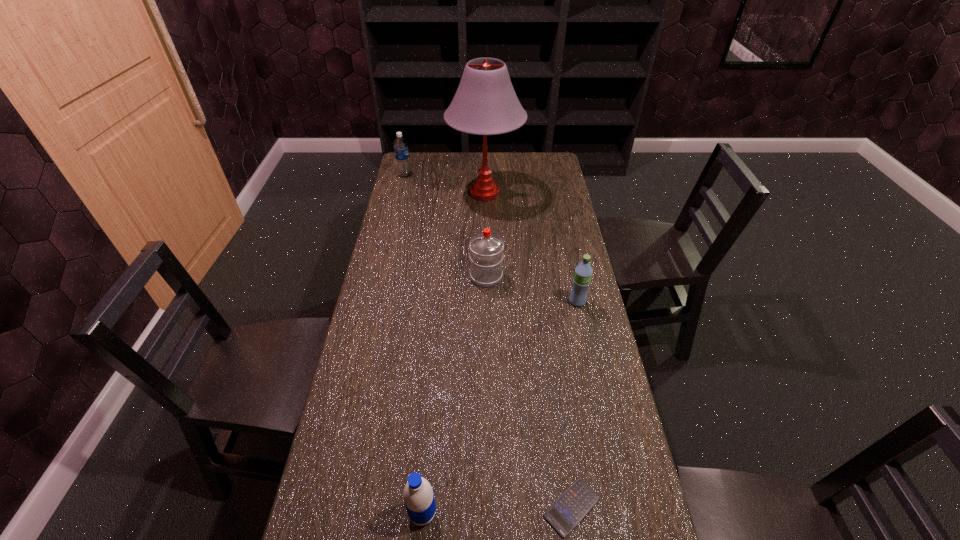
Find the location of a particular element. The width and height of the screenshot is (960, 540). empty location between the rightmost water bottle and the fourth nearest object is located at coordinates (532, 289).

The height and width of the screenshot is (540, 960). Find the location of `blank region between the rightmost water bottle and the nearest water bottle`. blank region between the rightmost water bottle and the nearest water bottle is located at coordinates (500, 408).

The height and width of the screenshot is (540, 960). Identify the location of free area in between the calculator and the third water bottle from left to right. (529, 392).

The height and width of the screenshot is (540, 960). I want to click on vacant region between the table lamp and the third water bottle from right to left, so click(x=454, y=353).

Identify the location of free space between the table lamp and the leftmost object. (444, 184).

Locate an element on the screen. The width and height of the screenshot is (960, 540). vacant point located between the farthest water bottle and the third water bottle from right to left is located at coordinates (414, 344).

The image size is (960, 540). I want to click on empty location between the rightmost object and the tallest object, so click(531, 247).

Identify the location of free area in between the table lamp and the fourth farthest object. Image resolution: width=960 pixels, height=540 pixels. (531, 247).

Find the location of a particular element. vacant point located between the nearest water bottle and the third farthest water bottle is located at coordinates (500, 408).

This screenshot has height=540, width=960. In order to click on object that ranks as the second closest to the table lamp in this screenshot , I will do `click(486, 256)`.